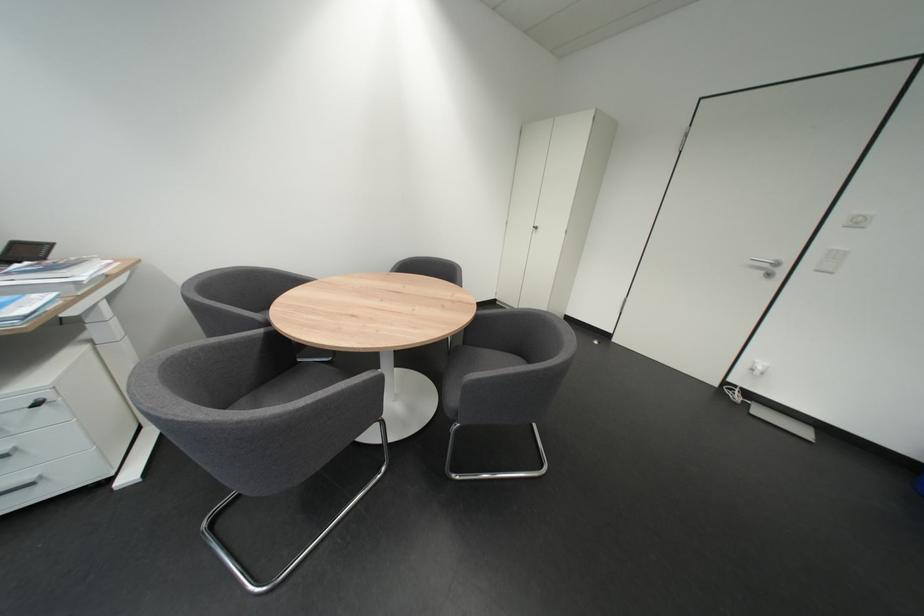
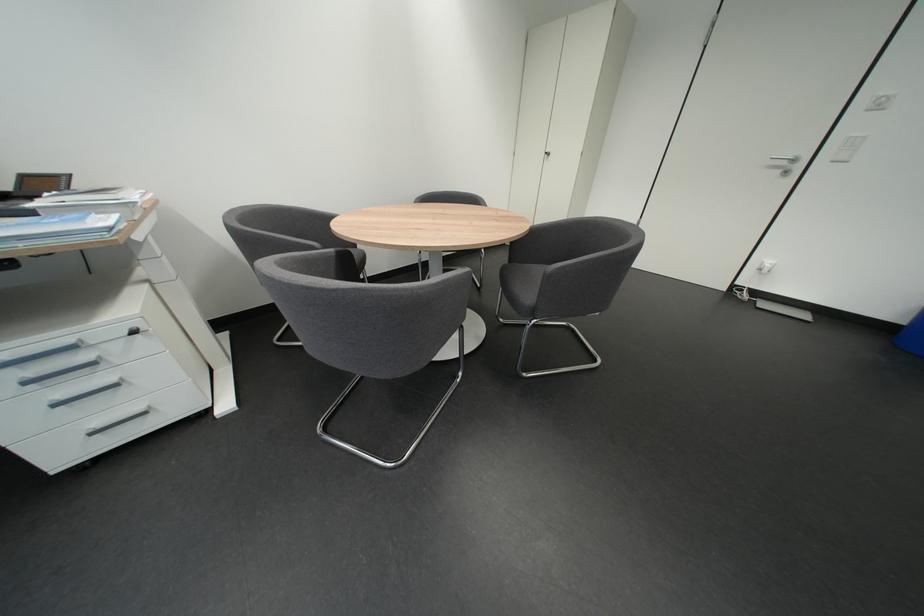
Question: Which direction would the cameraman need to move to produce the second image? Reply with the corresponding letter.

Choices:
 (A) Left
 (B) Right
 (C) Forward
 (D) Backward

Answer: (A)